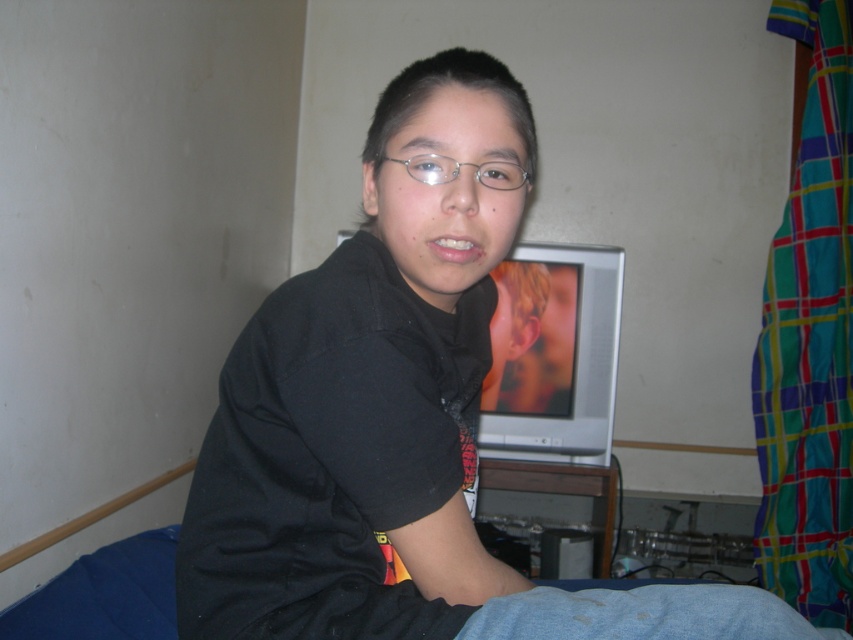
You are trying to determine the order of objects from closest to farthest from you in the scene. Given that you can see both the black matte shirt at center and clear plastic glasses at center, which object is closer to you?

The black matte shirt at center is closer to the viewer than the clear plastic glasses at center, so the black matte shirt at center is closer.

What are the coordinates of the black matte shirt at center?

The coordinates of the black matte shirt at center are at point (396,419).

You are a fashion designer trying to create a new line of clothing and accessories. You want to ensure that the shirt and glasses you design will fit together proportionally. Given the black matte shirt at center and the clear plastic glasses at center, which one has a greater width?

The black matte shirt at center has a greater width than the clear plastic glasses at center.